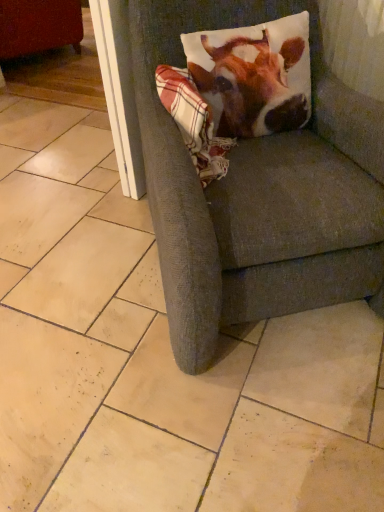
You are a GUI agent. You are given a task and a screenshot of the screen. Output one action in this format:
    pyautogui.click(x=<x>, y=<y>)
    Task: Click on the textured gray armchair at center
    
    Given the screenshot: What is the action you would take?
    pyautogui.click(x=258, y=191)

Locate an element on the screen. plaid fabric at upper right is located at coordinates click(x=193, y=122).

Considering their positions, is textured gray armchair at center located in front of or behind white glossy screen door at upper left?

Clearly, textured gray armchair at center is in front of white glossy screen door at upper left.

Is textured gray armchair at center positioned far away from white glossy screen door at upper left?

No, there isn't a large distance between textured gray armchair at center and white glossy screen door at upper left.

Can you tell me how much textured gray armchair at center and white glossy screen door at upper left differ in facing direction?

The facing directions of textured gray armchair at center and white glossy screen door at upper left are 131 degrees apart.

Where is `chair on the right side of plaid fabric at upper right`? The image size is (384, 512). chair on the right side of plaid fabric at upper right is located at coordinates (258, 191).

Could you tell me if plaid fabric at upper right is turned towards textured gray armchair at center?

Yes.

Would you say plaid fabric at upper right contains textured gray armchair at center?

Actually, textured gray armchair at center is outside plaid fabric at upper right.

Considering the positions of objects printed fabric pillow at upper right and textured gray armchair at center in the image provided, who is more to the left, printed fabric pillow at upper right or textured gray armchair at center?

textured gray armchair at center.

From a real-world perspective, between printed fabric pillow at upper right and textured gray armchair at center, who is vertically higher?

In real-world perspective, printed fabric pillow at upper right is above.

From the picture: Is printed fabric pillow at upper right oriented towards textured gray armchair at center?

Yes, printed fabric pillow at upper right is facing textured gray armchair at center.

Which is closer, (301, 104) or (288, 4)?

The point (301, 104) is in front.

Is textured gray armchair at center surrounding printed fabric pillow at upper right?

Absolutely, printed fabric pillow at upper right is inside textured gray armchair at center.

What's the angular difference between textured gray armchair at center and printed fabric pillow at upper right's facing directions?

textured gray armchair at center and printed fabric pillow at upper right are facing 0.442 degrees away from each other.

Between textured gray armchair at center and printed fabric pillow at upper right, which one has smaller size?

With smaller size is printed fabric pillow at upper right.

Measure the distance from textured gray armchair at center to printed fabric pillow at upper right.

The distance of textured gray armchair at center from printed fabric pillow at upper right is 22.97 centimeters.

Is matte red swivel chair at upper left not inside printed fabric pillow at upper right?

Yes, matte red swivel chair at upper left is not within printed fabric pillow at upper right.

Is printed fabric pillow at upper right at the back of matte red swivel chair at upper left?

No, matte red swivel chair at upper left's orientation is not away from printed fabric pillow at upper right.

Between matte red swivel chair at upper left and printed fabric pillow at upper right, which one has smaller size?

With smaller size is printed fabric pillow at upper right.

From the image's perspective, is matte red swivel chair at upper left on printed fabric pillow at upper right?

Yes, from the image's perspective, matte red swivel chair at upper left is over printed fabric pillow at upper right.

Does plaid fabric at upper right appear on the right side of printed fabric pillow at upper right?

Incorrect, plaid fabric at upper right is not on the right side of printed fabric pillow at upper right.

In the image, is plaid fabric at upper right positioned in front of or behind printed fabric pillow at upper right?

In the image, plaid fabric at upper right appears in front of printed fabric pillow at upper right.

Is printed fabric pillow at upper right at the back of plaid fabric at upper right?

That's not correct — plaid fabric at upper right is not looking away from printed fabric pillow at upper right.

Is point (217, 145) farther from viewer compared to point (213, 52)?

No.

Between matte red swivel chair at upper left and plaid fabric at upper right, which one appears on the left side from the viewer's perspective?

From the viewer's perspective, matte red swivel chair at upper left appears more on the left side.

Looking at this image, considering the sizes of objects matte red swivel chair at upper left and plaid fabric at upper right in the image provided, who is smaller, matte red swivel chair at upper left or plaid fabric at upper right?

plaid fabric at upper right is smaller.

Is matte red swivel chair at upper left in contact with plaid fabric at upper right?

matte red swivel chair at upper left and plaid fabric at upper right are not in contact.

The width and height of the screenshot is (384, 512). Identify the location of swivel chair above the plaid fabric at upper right (from the image's perspective). (39, 26).

Locate an element on the screen. screen door on the left of textured gray armchair at center is located at coordinates (119, 91).

Find the location of a particular element. Image resolution: width=384 pixels, height=512 pixels. chair in front of the plaid fabric at upper right is located at coordinates (258, 191).

From the image, which object appears to be nearer to plaid fabric at upper right, matte red swivel chair at upper left or textured gray armchair at center?

Among the two, textured gray armchair at center is located nearer to plaid fabric at upper right.

Based on their spatial positions, is textured gray armchair at center or matte red swivel chair at upper left further from plaid fabric at upper right?

matte red swivel chair at upper left is further to plaid fabric at upper right.

Looking at the image, which one is located further to textured gray armchair at center, plaid fabric at upper right or matte red swivel chair at upper left?

matte red swivel chair at upper left is further to textured gray armchair at center.

Looking at the image, which one is located closer to plaid fabric at upper right, printed fabric pillow at upper right or white glossy screen door at upper left?

The object closer to plaid fabric at upper right is printed fabric pillow at upper right.

When comparing their distances from matte red swivel chair at upper left, does white glossy screen door at upper left or textured gray armchair at center seem further?

textured gray armchair at center.

From the image, which object appears to be nearer to textured gray armchair at center, white glossy screen door at upper left or plaid fabric at upper right?

plaid fabric at upper right lies closer to textured gray armchair at center than the other object.

Based on their spatial positions, is textured gray armchair at center or printed fabric pillow at upper right further from matte red swivel chair at upper left?

Based on the image, textured gray armchair at center appears to be further to matte red swivel chair at upper left.

From the image, which object appears to be nearer to plaid fabric at upper right, white glossy screen door at upper left or matte red swivel chair at upper left?

Among the two, white glossy screen door at upper left is located nearer to plaid fabric at upper right.

Locate an element on the screen. The width and height of the screenshot is (384, 512). blanket located between white glossy screen door at upper left and printed fabric pillow at upper right in the left-right direction is located at coordinates (193, 122).

Locate an element on the screen. cattle positioned between textured gray armchair at center and white glossy screen door at upper left from near to far is located at coordinates (251, 79).

Where is `blanket between textured gray armchair at center and matte red swivel chair at upper left from front to back`? blanket between textured gray armchair at center and matte red swivel chair at upper left from front to back is located at coordinates (193, 122).

What are the coordinates of `blanket located between textured gray armchair at center and white glossy screen door at upper left in the depth direction` in the screenshot? It's located at (193, 122).